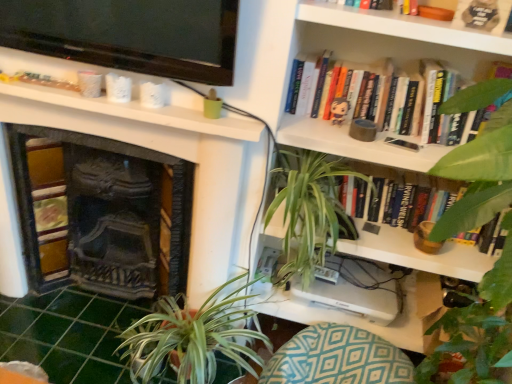
Describe the element at coordinates (339, 110) in the screenshot. I see `matte plastic toy at upper center` at that location.

Find the location of a particular element. white glossy bookshelf at upper right is located at coordinates (343, 60).

What do you see at coordinates (309, 211) in the screenshot? This screenshot has height=384, width=512. I see `green leafy plant at center, placed as the first vegetation when sorted from left to right` at bounding box center [309, 211].

The height and width of the screenshot is (384, 512). What do you see at coordinates (407, 181) in the screenshot?
I see `hardcover book at center, which ranks as the third book in top-to-bottom order` at bounding box center [407, 181].

At what (x,y) coordinates should I click in order to perform the action: click on green leafy plant at upper right, which appears as the second vegetation when viewed from the left. Please return your answer as a coordinate pair (x, y). This screenshot has height=384, width=512. Looking at the image, I should click on (471, 345).

In the image, there is a hardcover book at upper right, the 2th book in the top-to-bottom sequence. Where is `houseplant below it (from the image's perspective)`? The width and height of the screenshot is (512, 384). houseplant below it (from the image's perspective) is located at coordinates (192, 337).

Which is more to the right, hardcover book at upper right, positioned as the 2th book in bottom-to-top order, or green leafy plant at lower left?

From the viewer's perspective, hardcover book at upper right, positioned as the 2th book in bottom-to-top order, appears more on the right side.

From the image's perspective, is hardcover book at upper right, the 2th book in the top-to-bottom sequence, located above or below green leafy plant at lower left?

hardcover book at upper right, the 2th book in the top-to-bottom sequence, is above green leafy plant at lower left.

Who is more distant, hardcover book at upper right, positioned as the 2th book in bottom-to-top order, or green leafy plant at lower left?

hardcover book at upper right, positioned as the 2th book in bottom-to-top order.

You are a GUI agent. You are given a task and a screenshot of the screen. Output one action in this format:
    pyautogui.click(x=<x>, y=<y>)
    Task: Click on the book that appears below the matte plastic toy at upper center (from a real-world perspective)
    Image resolution: width=512 pixels, height=384 pixels.
    Given the screenshot: What is the action you would take?
    pyautogui.click(x=407, y=181)

Based on the photo, is hardcover book at center, placed as the 1th book when sorted from bottom to top, not near matte plastic toy at upper center?

No.

Considering the sizes of objects hardcover book at center, placed as the 1th book when sorted from bottom to top, and matte plastic toy at upper center in the image provided, who is thinner, hardcover book at center, placed as the 1th book when sorted from bottom to top, or matte plastic toy at upper center?

With smaller width is matte plastic toy at upper center.

Can you confirm if teal diamond-patterned cushion at lower center is wider than green leafy plant at upper right, which appears as the second vegetation when viewed from the left?

Yes, teal diamond-patterned cushion at lower center is wider than green leafy plant at upper right, which appears as the second vegetation when viewed from the left.

Is teal diamond-patterned cushion at lower center far from green leafy plant at upper right, which appears as the second vegetation when viewed from the left?

Actually, teal diamond-patterned cushion at lower center and green leafy plant at upper right, which appears as the second vegetation when viewed from the left, are a little close together.

From the image's perspective, is teal diamond-patterned cushion at lower center above green leafy plant at upper right, which appears as the second vegetation when viewed from the left?

No, from the image's perspective, teal diamond-patterned cushion at lower center is not over green leafy plant at upper right, which appears as the second vegetation when viewed from the left.

Which is more to the left, teal diamond-patterned cushion at lower center or green leafy plant at upper right, the first vegetation from the right?

teal diamond-patterned cushion at lower center is more to the left.

Looking at this image, from a real-world perspective, is hardcover book at upper right, the third book from the bottom, located beneath white glossy bookshelf at upper right?

No, from a real-world perspective, hardcover book at upper right, the third book from the bottom, is not under white glossy bookshelf at upper right.

From the image's perspective, is hardcover book at upper right, the third book from the bottom, beneath white glossy bookshelf at upper right?

No, from the image's perspective, hardcover book at upper right, the third book from the bottom, is not below white glossy bookshelf at upper right.

The width and height of the screenshot is (512, 384). What are the coordinates of `bookshelf lying below the hardcover book at upper right, the third book from the bottom (from the image's perspective)` in the screenshot? It's located at (343, 60).

Is hardcover book at upper right, the third book from the bottom, spatially inside white glossy bookshelf at upper right, or outside of it?

hardcover book at upper right, the third book from the bottom, is spatially situated outside white glossy bookshelf at upper right.

Considering the relative positions of hardcover book at center, placed as the 1th book when sorted from bottom to top, and hardcover book at upper right, which is the first book in top-to-bottom order, in the image provided, is hardcover book at center, placed as the 1th book when sorted from bottom to top, to the left of hardcover book at upper right, which is the first book in top-to-bottom order, from the viewer's perspective?

In fact, hardcover book at center, placed as the 1th book when sorted from bottom to top, is to the right of hardcover book at upper right, which is the first book in top-to-bottom order.

From a real-world perspective, does hardcover book at center, which ranks as the third book in top-to-bottom order, sit lower than hardcover book at upper right, which is the first book in top-to-bottom order?

Correct, in the physical world, hardcover book at center, which ranks as the third book in top-to-bottom order, is lower than hardcover book at upper right, which is the first book in top-to-bottom order.

From the image's perspective, which one is positioned higher, hardcover book at center, which ranks as the third book in top-to-bottom order, or hardcover book at upper right, which is the first book in top-to-bottom order?

hardcover book at upper right, which is the first book in top-to-bottom order, is shown above in the image.

Is hardcover book at center, placed as the 1th book when sorted from bottom to top, oriented away from hardcover book at upper right, the third book from the bottom?

No, hardcover book at center, placed as the 1th book when sorted from bottom to top, is not facing away from hardcover book at upper right, the third book from the bottom.

Can you confirm if hardcover book at center, placed as the 1th book when sorted from bottom to top, is positioned to the left of green leafy plant at upper right, the first vegetation from the right?

Yes.

Considering the points (398, 180) and (504, 335), which point is in front, point (398, 180) or point (504, 335)?

Point (504, 335)

From a real-world perspective, starting from the green leafy plant at upper right, which appears as the second vegetation when viewed from the left, which book is the 1st one vertically above it? Please provide its 2D coordinates.

[(407, 181)]

Considering the relative sizes of hardcover book at center, placed as the 1th book when sorted from bottom to top, and green leafy plant at upper right, the first vegetation from the right, in the image provided, is hardcover book at center, placed as the 1th book when sorted from bottom to top, bigger than green leafy plant at upper right, the first vegetation from the right,?

Indeed, hardcover book at center, placed as the 1th book when sorted from bottom to top, has a larger size compared to green leafy plant at upper right, the first vegetation from the right.

Can you confirm if hardcover book at upper right, the 2th book in the top-to-bottom sequence, is taller than white glossy bookshelf at upper right?

In fact, hardcover book at upper right, the 2th book in the top-to-bottom sequence, may be shorter than white glossy bookshelf at upper right.

Which of these two, hardcover book at upper right, positioned as the 2th book in bottom-to-top order, or white glossy bookshelf at upper right, is smaller?

With smaller size is hardcover book at upper right, positioned as the 2th book in bottom-to-top order.

Which object is thinner, hardcover book at upper right, positioned as the 2th book in bottom-to-top order, or white glossy bookshelf at upper right?

hardcover book at upper right, positioned as the 2th book in bottom-to-top order.

At what (x,y) coordinates should I click in order to perform the action: click on houseplant that appears in front of the hardcover book at upper right, positioned as the 2th book in bottom-to-top order. Please return your answer as a coordinate pair (x, y). This screenshot has width=512, height=384. Looking at the image, I should click on (192, 337).

Locate an element on the screen. toy located above the hardcover book at center, placed as the 1th book when sorted from bottom to top (from the image's perspective) is located at coordinates 339,110.

Looking at the image, which one is located further to green leafy plant at upper right, the first vegetation from the right, white glossy bookshelf at upper right or hardcover book at upper right, positioned as the 2th book in bottom-to-top order?

hardcover book at upper right, positioned as the 2th book in bottom-to-top order, is positioned further to the anchor green leafy plant at upper right, the first vegetation from the right.

Considering their positions, is green leafy plant at lower left positioned closer to teal diamond-patterned cushion at lower center than hardcover book at upper right, which is the first book in top-to-bottom order?

green leafy plant at lower left is positioned closer to the anchor teal diamond-patterned cushion at lower center.

Considering their positions, is white glossy bookshelf at upper right positioned further to teal diamond-patterned cushion at lower center than green leafy plant at center, acting as the 2th vegetation starting from the right?

Among the two, white glossy bookshelf at upper right is located further to teal diamond-patterned cushion at lower center.

In the scene shown: Which object lies nearer to the anchor point green leafy plant at center, acting as the 2th vegetation starting from the right, green leafy plant at lower left or hardcover book at upper right, the 2th book in the top-to-bottom sequence?

The object closer to green leafy plant at center, acting as the 2th vegetation starting from the right, is hardcover book at upper right, the 2th book in the top-to-bottom sequence.

Looking at the image, which one is located further to white glossy bookshelf at upper right, hardcover book at upper right, positioned as the 2th book in bottom-to-top order, or green leafy plant at lower left?

green leafy plant at lower left lies further to white glossy bookshelf at upper right than the other object.

From the image, which object appears to be nearer to green leafy plant at center, acting as the 2th vegetation starting from the right, hardcover book at center, placed as the 1th book when sorted from bottom to top, or teal diamond-patterned cushion at lower center?

hardcover book at center, placed as the 1th book when sorted from bottom to top, lies closer to green leafy plant at center, acting as the 2th vegetation starting from the right, than the other object.

Looking at the image, which one is located further to green leafy plant at upper right, which appears as the second vegetation when viewed from the left, matte plastic toy at upper center or hardcover book at upper right, which is the first book in top-to-bottom order?

The object further to green leafy plant at upper right, which appears as the second vegetation when viewed from the left, is hardcover book at upper right, which is the first book in top-to-bottom order.

Considering their positions, is white glossy bookshelf at upper right positioned closer to hardcover book at center, placed as the 1th book when sorted from bottom to top, than matte plastic toy at upper center?

white glossy bookshelf at upper right is positioned closer to the anchor hardcover book at center, placed as the 1th book when sorted from bottom to top.

The height and width of the screenshot is (384, 512). Identify the location of swivel chair located between white glossy bookshelf at upper right and matte plastic toy at upper center in the depth direction. (337, 358).

The image size is (512, 384). In order to click on swivel chair situated between green leafy plant at center, acting as the 2th vegetation starting from the right, and green leafy plant at upper right, the first vegetation from the right, from left to right in this screenshot , I will do `click(337, 358)`.

Find the location of a particular element. toy between hardcover book at upper right, the third book from the bottom, and teal diamond-patterned cushion at lower center in the up-down direction is located at coordinates (339, 110).

I want to click on toy between hardcover book at upper right, the third book from the bottom, and green leafy plant at lower left vertically, so click(339, 110).